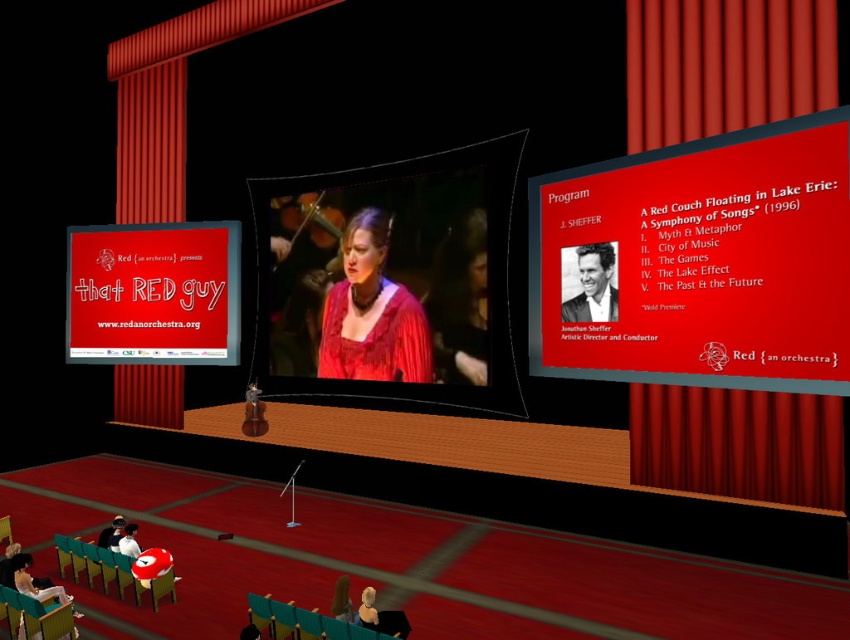
You are a stagehand preparing to adjust the lighting for the performance. You need to position a spotlight so it can illuminate both the matte red curtain at upper right and the velvet red curtain at right without overlapping their lit areas. Based on their positions, which curtain should be lit first to ensure proper coverage?

The velvet red curtain at right is behind the matte red curtain at upper right, so you should light the matte red curtain at upper right first. This way, the spotlight can reach it without being blocked by the velvet red curtain at right, ensuring both curtains are properly illuminated without overlapping their lit areas.

You are a stagehand standing at the back of the stage. You need to adjust the lighting for the upcoming performance. Which object, the matte red sign at center or the wooden violin at center, should you focus on first if you want to adjust the one that is closer to the audience?

The matte red sign at center is closer to the viewer than the wooden violin at center, so you should focus on adjusting the lighting for the matte red sign at center first.